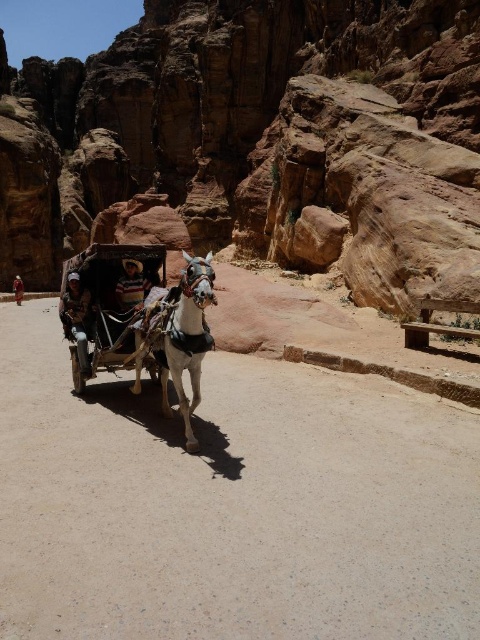
You are a passenger in the wooden cart at center and you dropped your dark brown leather jacket at left. Can you reach it while the cart is moving?

The wooden cart at center is positioned over the dark brown leather jacket at left, so it is likely blocking access to it. You might need to stop the cart to safely retrieve your jacket.

You are a passenger in the horse drawn carriage and you see two points in the scene. The first point is at point (204,301) and the second point is at point (122,285). Which point is closer to the front of the carriage?

Point (204,301) is in front of point (122,285), so the first point is closer to the front of the carriage.